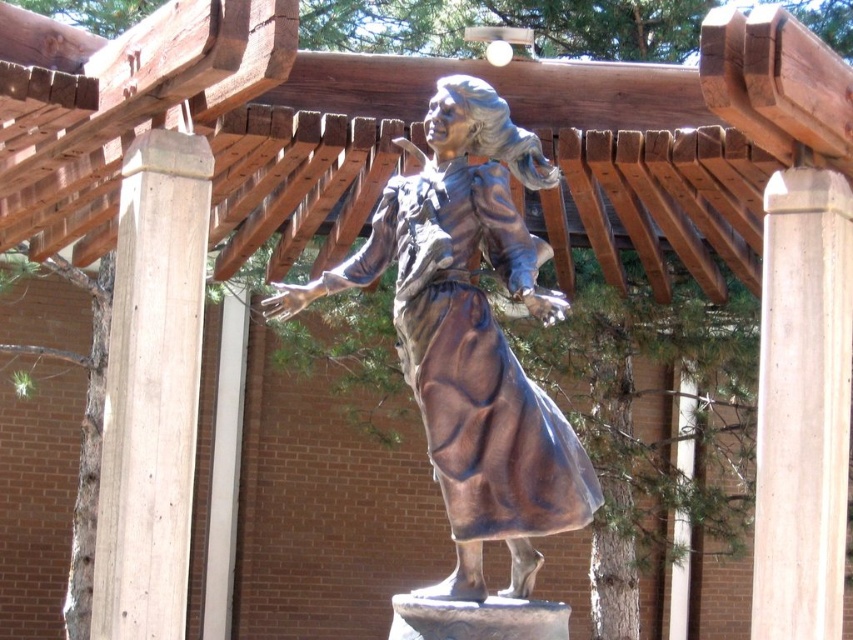
Question: Which object appears closest to the camera in this image?

Choices:
 (A) smooth concrete pillar at right
 (B) smooth light brown wood at left

Answer: (B)

Question: Can you confirm if bronze statue at center is positioned to the left of smooth light brown wood at left?

Choices:
 (A) no
 (B) yes

Answer: (A)

Question: Which point appears closest to the camera in this image?

Choices:
 (A) (849, 214)
 (B) (117, 502)
 (C) (511, 145)

Answer: (C)

Question: Is bronze statue at center closer to camera compared to smooth concrete pillar at right?

Choices:
 (A) no
 (B) yes

Answer: (B)

Question: Considering the real-world distances, which object is farthest from the bronze statue at center?

Choices:
 (A) smooth concrete pillar at right
 (B) smooth light brown wood at left

Answer: (A)

Question: Is the position of bronze statue at center more distant than that of smooth light brown wood at left?

Choices:
 (A) yes
 (B) no

Answer: (B)